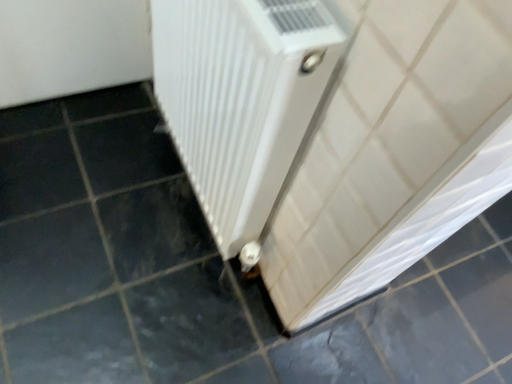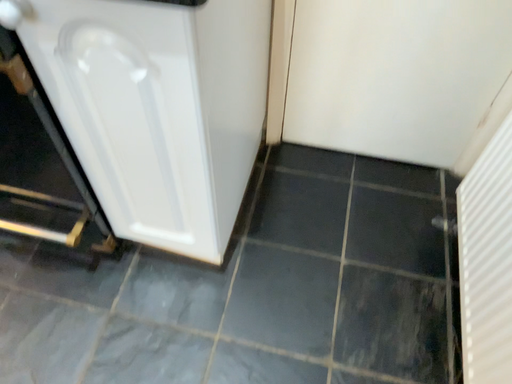
Question: How did the camera likely rotate when shooting the video?

Choices:
 (A) rotated right
 (B) rotated left

Answer: (B)